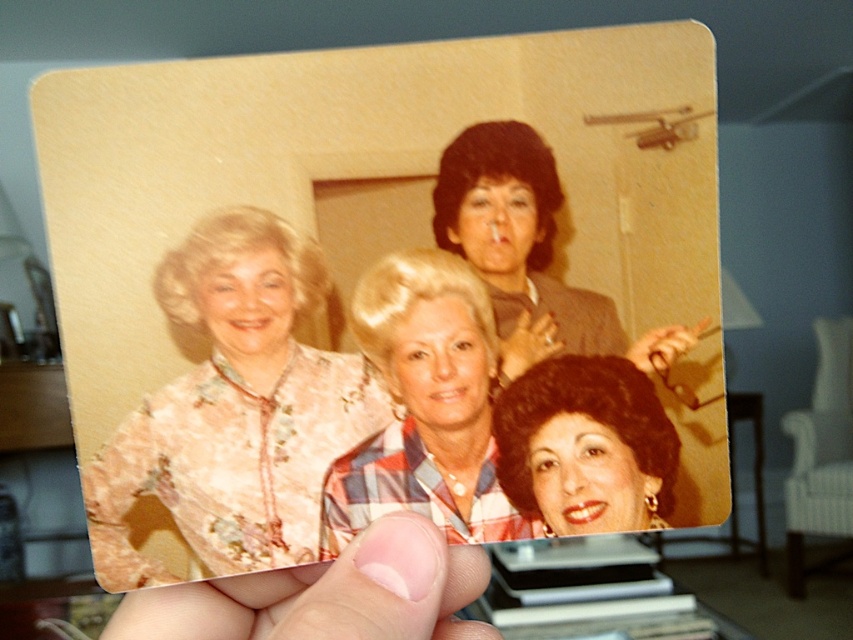
Can you confirm if nail polish at lower center is thinner than matte gray suit at center?

No, nail polish at lower center is not thinner than matte gray suit at center.

Based on the photo, who is lower down, nail polish at lower center or matte gray suit at center?

Positioned lower is nail polish at lower center.

Does point (393, 625) come farther from viewer compared to point (699, 326)?

No, it is in front of (699, 326).

In order to click on nail polish at lower center in this screenshot , I will do `click(328, 595)`.

Does floral-patterned blouse at center have a lesser width compared to plaid fabric shirt at center?

In fact, floral-patterned blouse at center might be wider than plaid fabric shirt at center.

From the picture: Can you confirm if floral-patterned blouse at center is positioned below plaid fabric shirt at center?

Yes.

Image resolution: width=853 pixels, height=640 pixels. Identify the location of floral-patterned blouse at center. (234, 412).

Which is behind, point (407, 403) or point (399, 609)?

Positioned behind is point (407, 403).

Is point (373, 264) farther from camera compared to point (430, 545)?

Yes, point (373, 264) is farther from viewer.

Who is more distant from viewer, (477, 317) or (318, 612)?

Positioned behind is point (477, 317).

What are the coordinates of `plaid fabric shirt at center` in the screenshot? It's located at (425, 406).